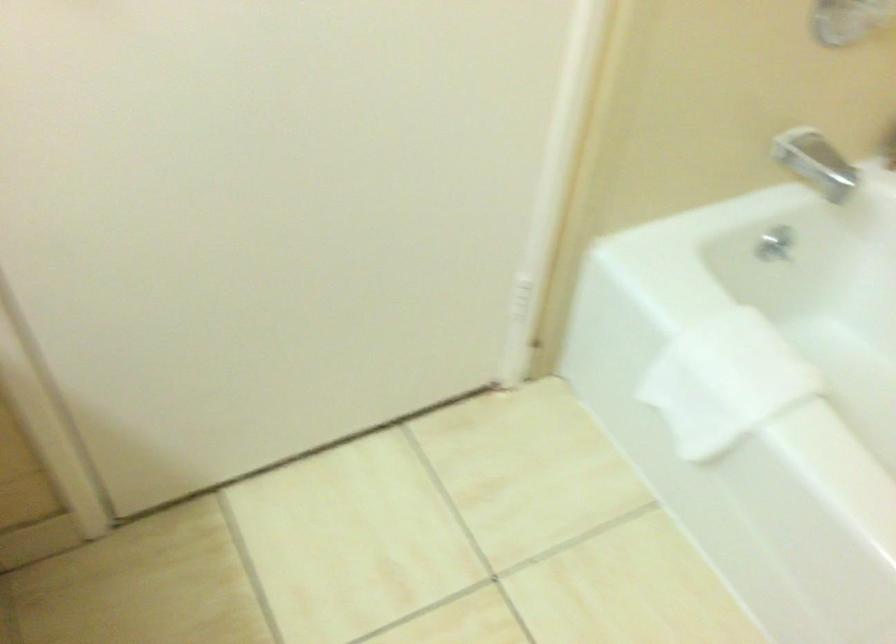
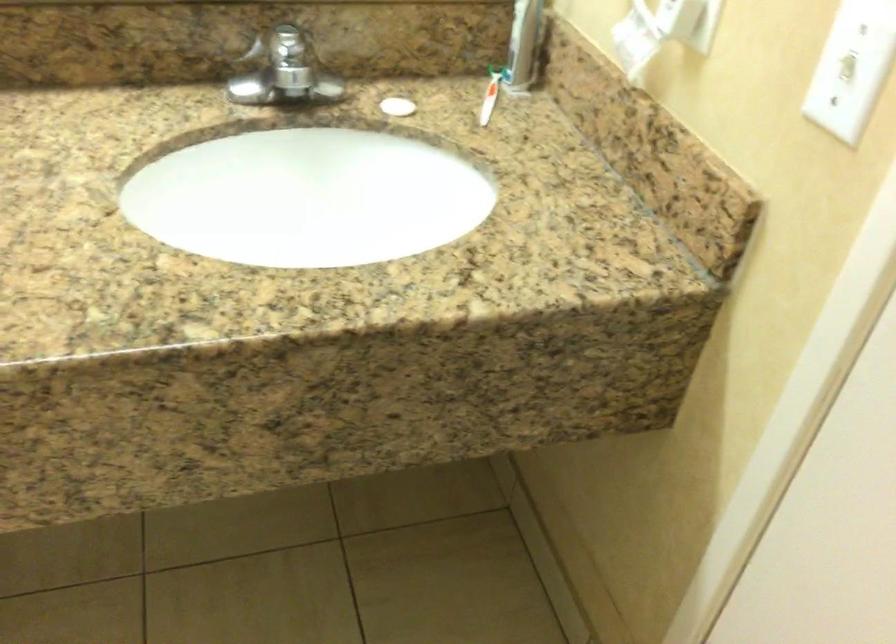
First-person continuous shooting, in which direction is the camera rotating?

The camera rotated toward left-down.